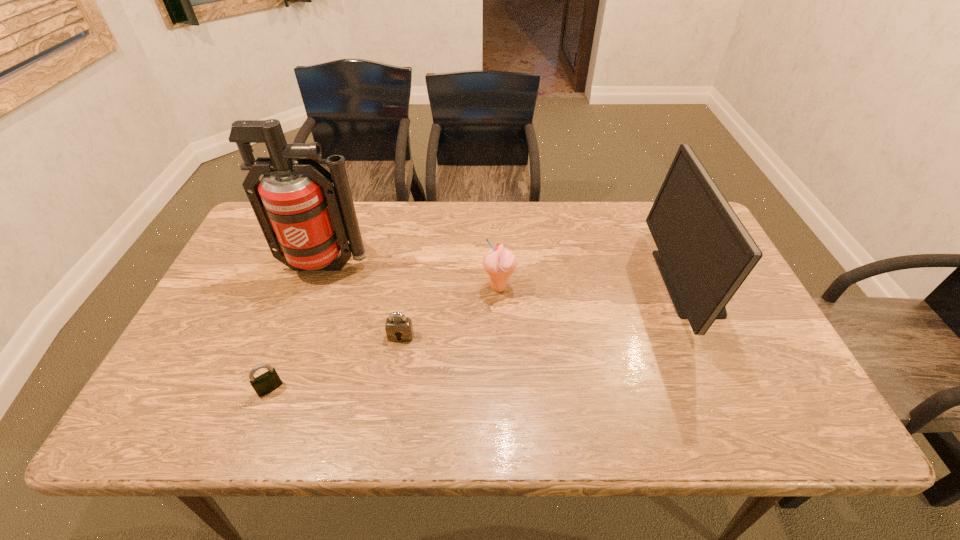
Where is `free region located on the screen side of the computer monitor`? This screenshot has height=540, width=960. free region located on the screen side of the computer monitor is located at coordinates (576, 283).

Find the location of `vacant space situated 0.190m on the screen side of the computer monitor`. vacant space situated 0.190m on the screen side of the computer monitor is located at coordinates 594,283.

Identify the location of free space located on the screen side of the computer monitor. (518, 283).

This screenshot has width=960, height=540. I want to click on vacant space located on the right of the second object from right to left, so click(x=562, y=287).

You are a GUI agent. You are given a task and a screenshot of the screen. Output one action in this format:
    pyautogui.click(x=<x>, y=<y>)
    Task: Click on the free space located at the front of the farther padlock near the keyhole
    
    Given the screenshot: What is the action you would take?
    pyautogui.click(x=396, y=363)

Where is `free space located on the left of the nearest object`? The height and width of the screenshot is (540, 960). free space located on the left of the nearest object is located at coordinates tap(166, 388).

Locate an element on the screen. This screenshot has height=540, width=960. object that is at the far edge is located at coordinates (705, 253).

The height and width of the screenshot is (540, 960). In order to click on object located at the left edge in this screenshot , I will do `click(304, 217)`.

Find the location of a particular element. The height and width of the screenshot is (540, 960). object at the right edge is located at coordinates (705, 253).

Image resolution: width=960 pixels, height=540 pixels. I want to click on object located in the far right corner section of the desktop, so click(705, 253).